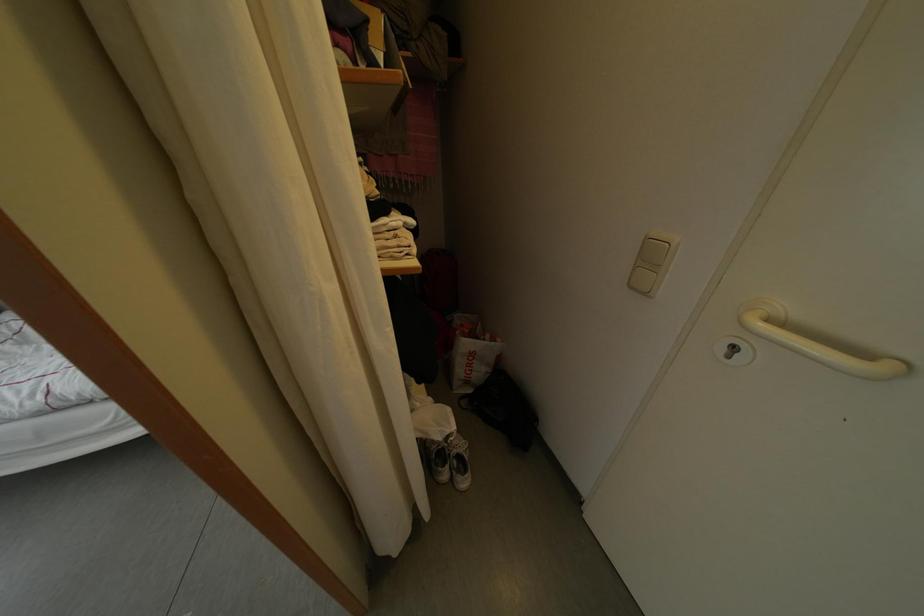
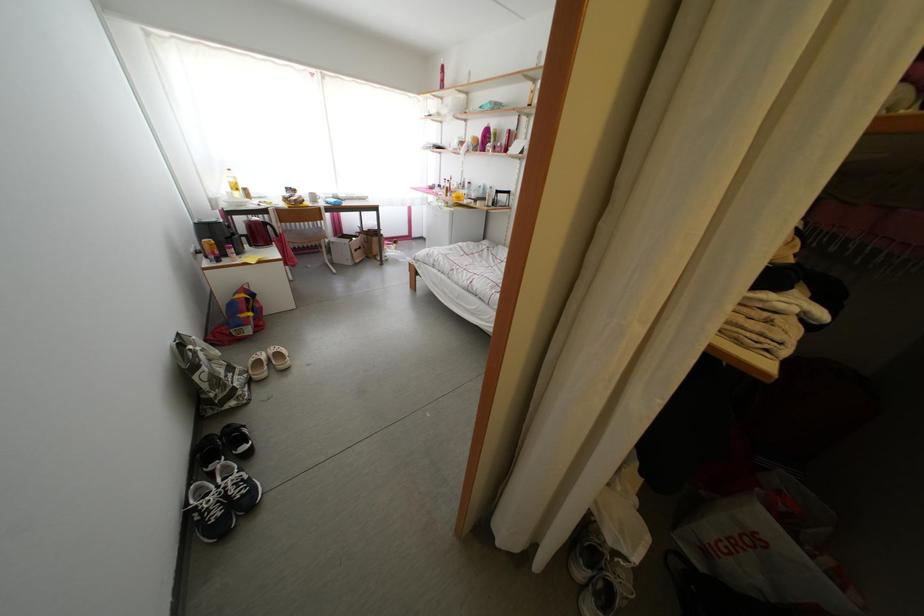
How did the camera likely rotate?

The rotation direction of the camera is left-down.